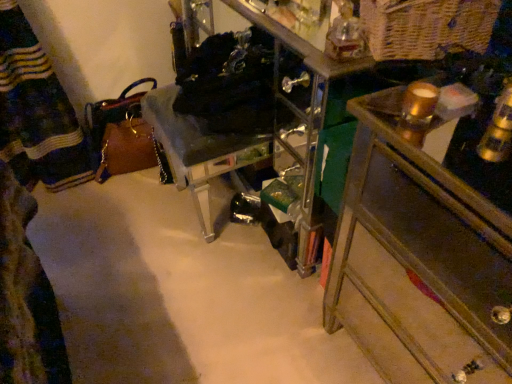
Question: Does gold metallic candle at upper right have a lesser height compared to woven natural basket at upper right?

Choices:
 (A) no
 (B) yes

Answer: (B)

Question: From a real-world perspective, is gold metallic candle at upper right located higher than woven natural basket at upper right?

Choices:
 (A) no
 (B) yes

Answer: (A)

Question: Is gold metallic candle at upper right to the right of woven natural basket at upper right from the viewer's perspective?

Choices:
 (A) no
 (B) yes

Answer: (A)

Question: Is gold metallic candle at upper right at the left side of woven natural basket at upper right?

Choices:
 (A) no
 (B) yes

Answer: (B)

Question: Does gold metallic candle at upper right have a greater height compared to woven natural basket at upper right?

Choices:
 (A) no
 (B) yes

Answer: (A)

Question: From the image's perspective, is wooden chest of drawers at right above or below black fabric laundry at center?

Choices:
 (A) below
 (B) above

Answer: (A)

Question: From their relative heights in the image, would you say wooden chest of drawers at right is taller or shorter than black fabric laundry at center?

Choices:
 (A) short
 (B) tall

Answer: (B)

Question: Based on their sizes in the image, would you say wooden chest of drawers at right is bigger or smaller than black fabric laundry at center?

Choices:
 (A) small
 (B) big

Answer: (B)

Question: Considering the relative positions of wooden chest of drawers at right and black fabric laundry at center in the image provided, is wooden chest of drawers at right to the left or to the right of black fabric laundry at center?

Choices:
 (A) right
 (B) left

Answer: (A)

Question: Considering their positions, is woven natural basket at upper right located in front of or behind wooden chest of drawers at right?

Choices:
 (A) behind
 (B) front

Answer: (A)

Question: Based on their positions, is woven natural basket at upper right located to the left or right of wooden chest of drawers at right?

Choices:
 (A) right
 (B) left

Answer: (B)

Question: From the image's perspective, relative to wooden chest of drawers at right, is woven natural basket at upper right above or below?

Choices:
 (A) above
 (B) below

Answer: (A)

Question: From a real-world perspective, is woven natural basket at upper right above or below wooden chest of drawers at right?

Choices:
 (A) below
 (B) above

Answer: (B)

Question: Visually, is black fabric laundry at center positioned to the left or to the right of clear acrylic chair at center?

Choices:
 (A) left
 (B) right

Answer: (B)

Question: Based on their sizes in the image, would you say black fabric laundry at center is bigger or smaller than clear acrylic chair at center?

Choices:
 (A) big
 (B) small

Answer: (B)